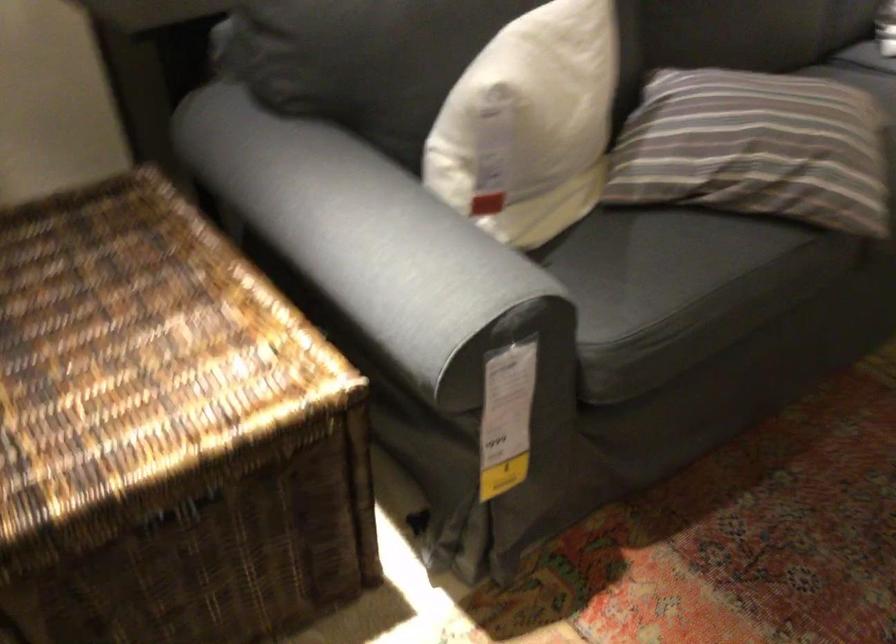
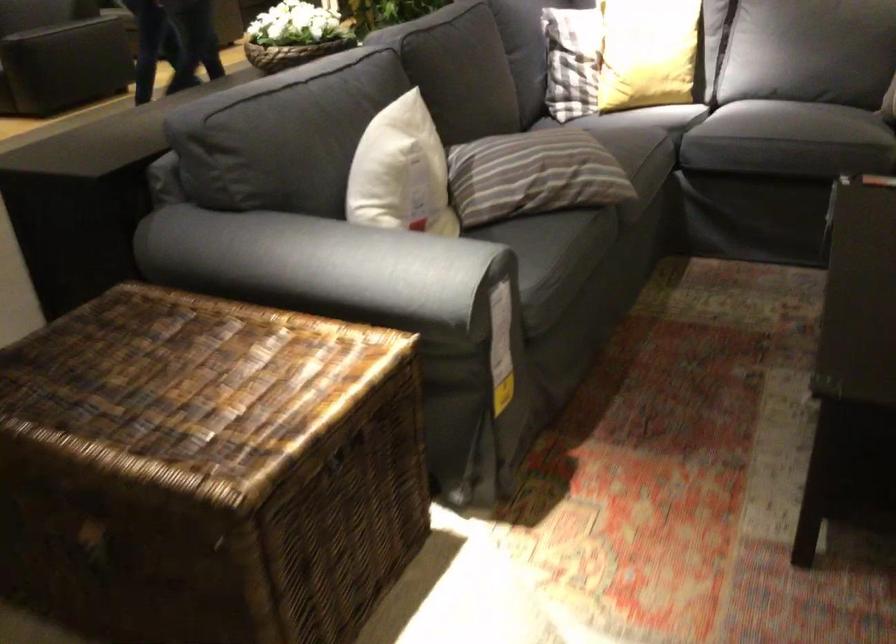
Question: I am providing you with two images of the same scene from different viewpoints. Which of the following objects are not visible in image2?

Choices:
 (A) grey sofa armrest
 (B) yellow pillow
 (C) checkered pillow
 (D) none of these

Answer: (D)